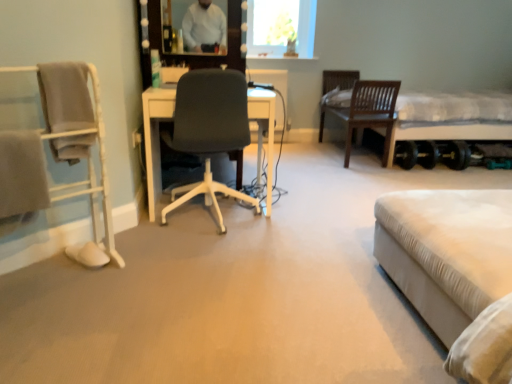
Find the location of a particular element. free point below white fabric chair at left, acting as the 3th chair starting from the right (from a real-world perspective) is located at coordinates (48, 279).